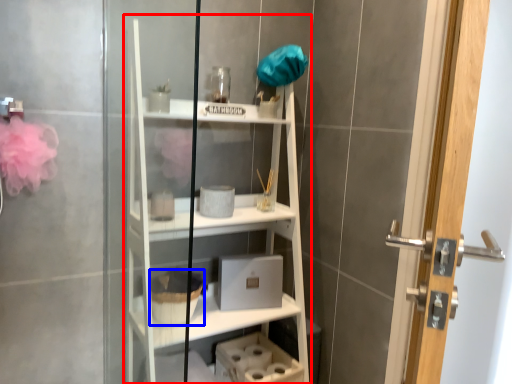
Question: Among these objects, which one is nearest to the camera, bookshelf (highlighted by a red box) or basket (highlighted by a blue box)?

Choices:
 (A) bookshelf
 (B) basket

Answer: (A)